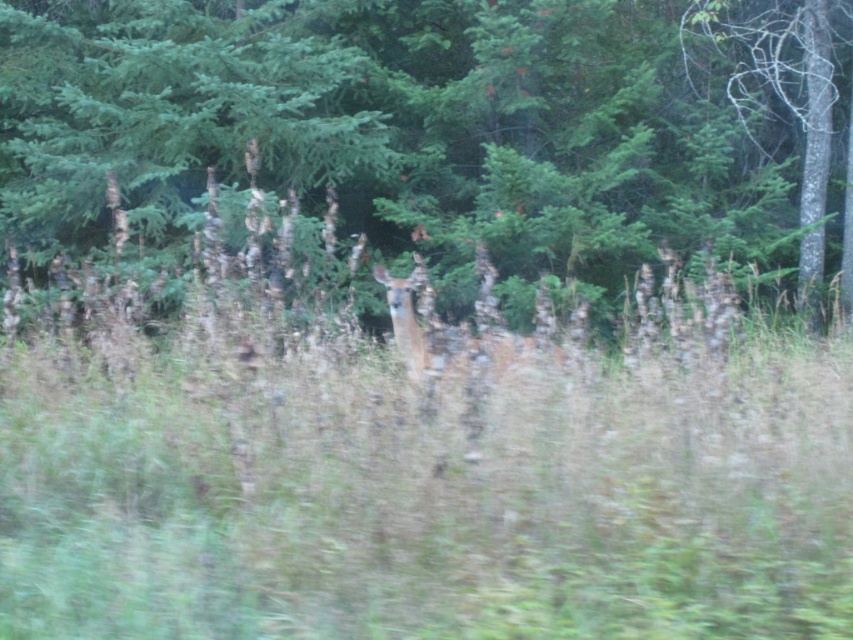
Question: Considering the real-world distances, which object is closest to the green matte tree at center?

Choices:
 (A) smooth bark tree at right
 (B) green grass at center

Answer: (A)

Question: In this image, where is green matte tree at center located relative to smooth bark tree at right?

Choices:
 (A) above
 (B) below

Answer: (A)

Question: Is green grass at center further to the viewer compared to green matte tree at center?

Choices:
 (A) yes
 (B) no

Answer: (B)

Question: In this image, where is green grass at center located relative to green matte tree at center?

Choices:
 (A) left
 (B) right

Answer: (B)

Question: Which is farther from the green grass at center?

Choices:
 (A) smooth bark tree at right
 (B) green matte tree at center

Answer: (A)

Question: Which of the following is the farthest from the observer?

Choices:
 (A) green matte tree at center
 (B) green grass at center

Answer: (A)